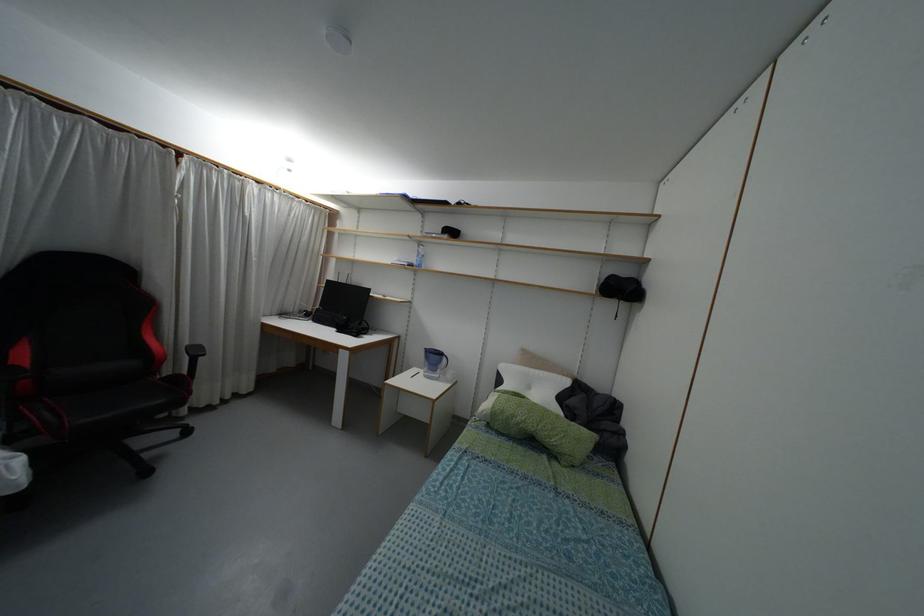
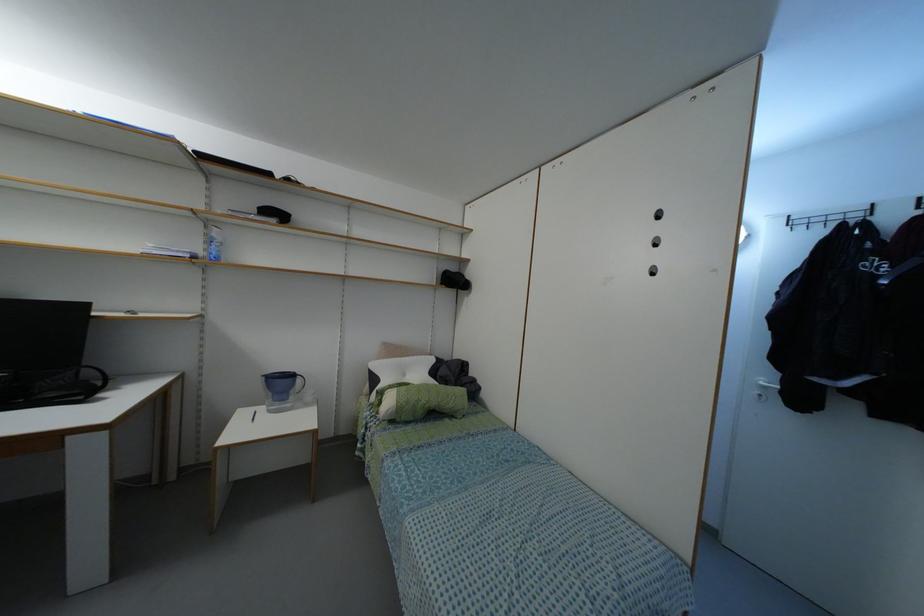
Question: The camera is either moving clockwise (left) or counter-clockwise (right) around the object. The first image is from the beginning of the video and the second image is from the end. Is the camera moving left or right when shooting the video?

Choices:
 (A) Left
 (B) Right

Answer: (A)